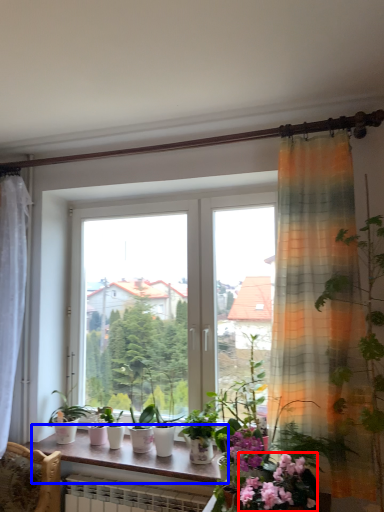
Question: Which point is further to the camera, flower (highlighted by a red box) or window sill (highlighted by a blue box)?

Choices:
 (A) flower
 (B) window sill

Answer: (B)